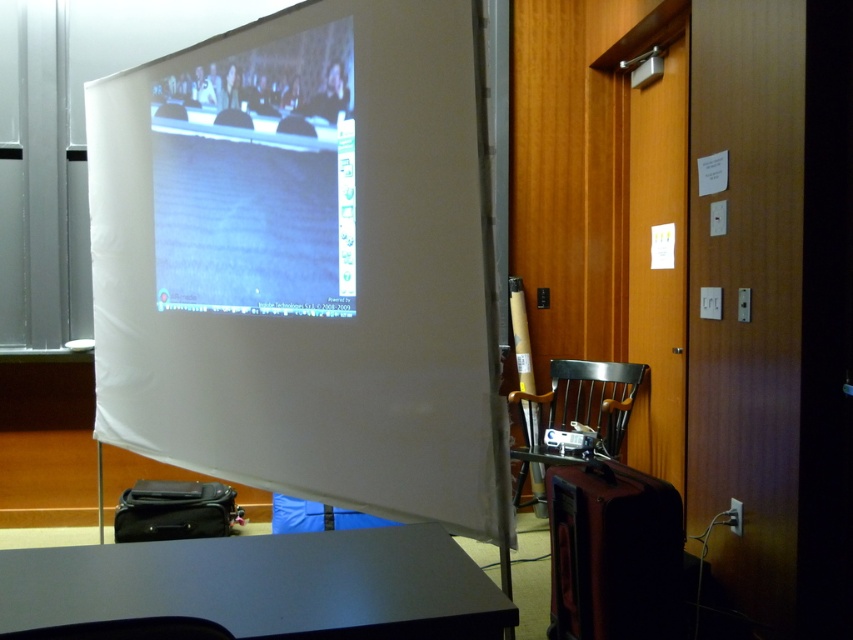
Question: Can you confirm if matte black table at lower center is smaller than black plastic projector at center?

Choices:
 (A) yes
 (B) no

Answer: (B)

Question: Based on their relative distances, which object is nearer to the matte black table at lower center?

Choices:
 (A) wooden chair at lower right
 (B) black plastic projector at center

Answer: (B)

Question: Which point appears closest to the camera in this image?

Choices:
 (A) (273, 618)
 (B) (573, 428)

Answer: (A)

Question: Observing the image, what is the correct spatial positioning of white matte projection screen at center in reference to black plastic projector at center?

Choices:
 (A) right
 (B) left

Answer: (B)

Question: Is white matte projection screen at center bigger than wooden chair at lower right?

Choices:
 (A) no
 (B) yes

Answer: (B)

Question: Which point is farther to the camera?

Choices:
 (A) black plastic projector at center
 (B) matte black table at lower center
 (C) wooden chair at lower right

Answer: (A)